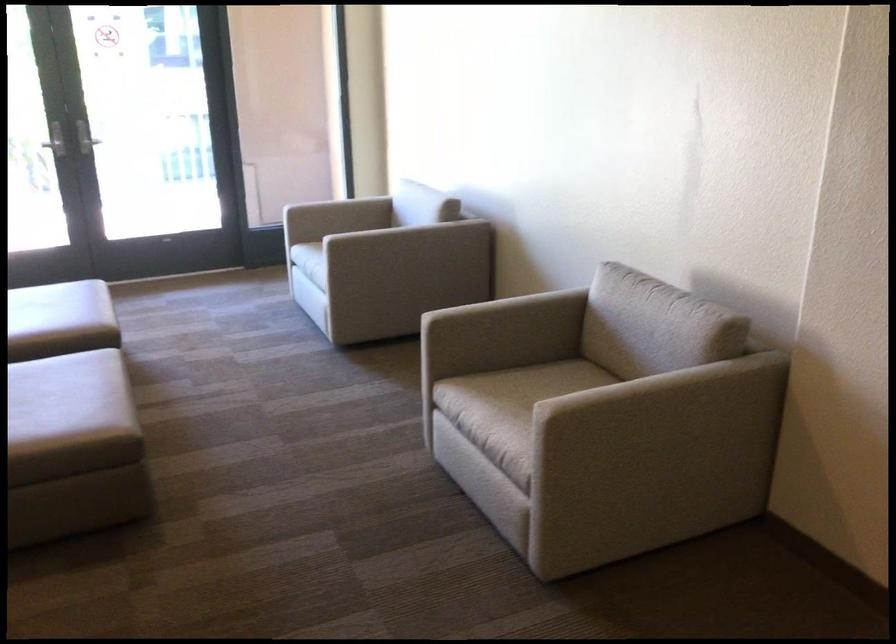
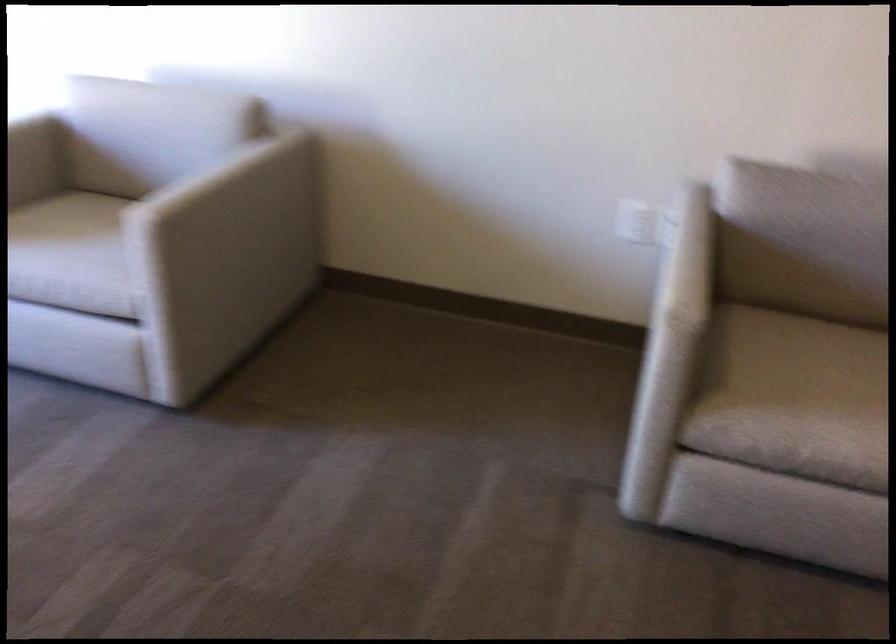
In the second image, find the point that corresponds to point 359,196 in the first image.

(28, 124)